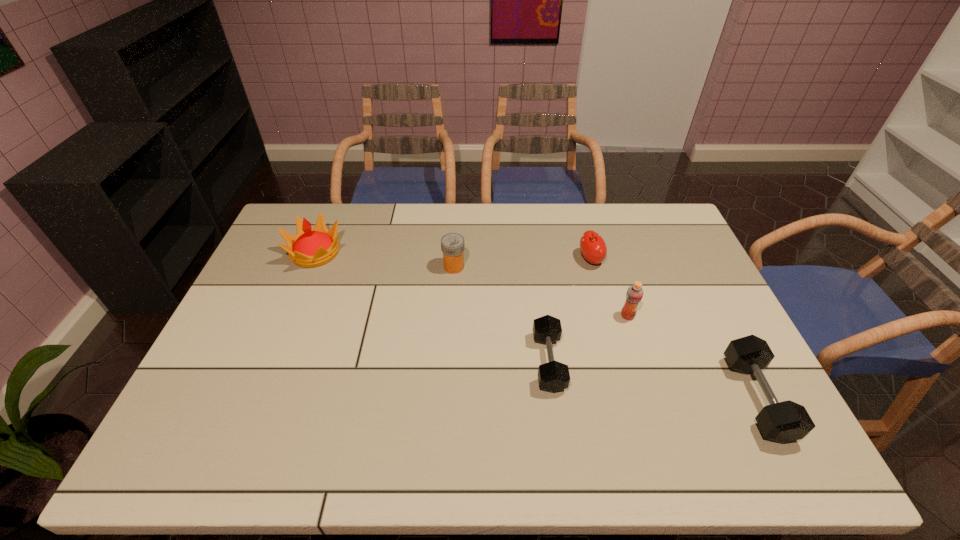
The height and width of the screenshot is (540, 960). I want to click on vacant space located on the right of the apple, so click(x=687, y=259).

Locate an element on the screen. The width and height of the screenshot is (960, 540). free point located 0.200m on the front of the crown is located at coordinates (287, 321).

At what (x,y) coordinates should I click in order to perform the action: click on vacant space located 0.050m on the right of the orange juice. Please return your answer as a coordinate pair (x, y). The width and height of the screenshot is (960, 540). Looking at the image, I should click on (652, 316).

The width and height of the screenshot is (960, 540). What are the coordinates of `vacant space situated on the label side of the second object from left to right` in the screenshot? It's located at (568, 267).

Find the location of a particular element. object positioned at the far edge is located at coordinates [x=309, y=247].

The image size is (960, 540). Find the location of `object that is at the left edge`. object that is at the left edge is located at coordinates (309, 247).

Image resolution: width=960 pixels, height=540 pixels. In order to click on object that is at the right edge in this screenshot , I will do `click(786, 421)`.

Where is `object present at the far left corner`? This screenshot has width=960, height=540. object present at the far left corner is located at coordinates (309, 247).

Locate an element on the screen. The width and height of the screenshot is (960, 540). object situated at the near right corner is located at coordinates (786, 421).

In the image, there is a desktop. Where is `free space at the far edge`? The width and height of the screenshot is (960, 540). free space at the far edge is located at coordinates (374, 221).